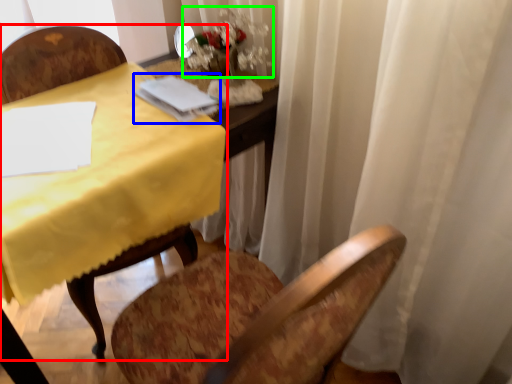
Question: Based on their relative distances, which object is farther from chair (highlighted by a red box)? Choose from notebook (highlighted by a blue box) and floral arrangement (highlighted by a green box).

Choices:
 (A) notebook
 (B) floral arrangement

Answer: (B)